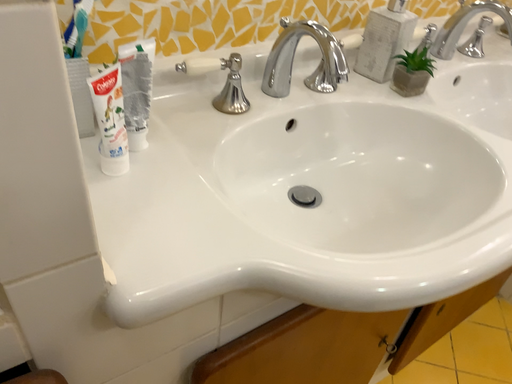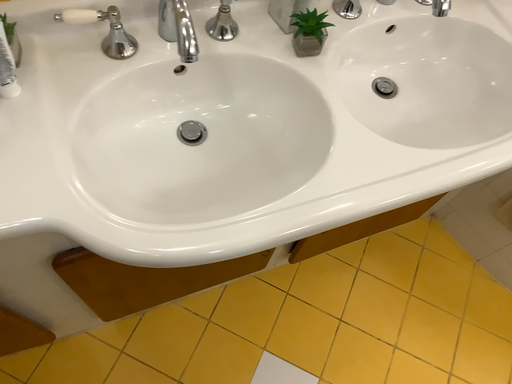
Question: How did the camera likely rotate when shooting the video?

Choices:
 (A) rotated upward
 (B) rotated downward

Answer: (B)